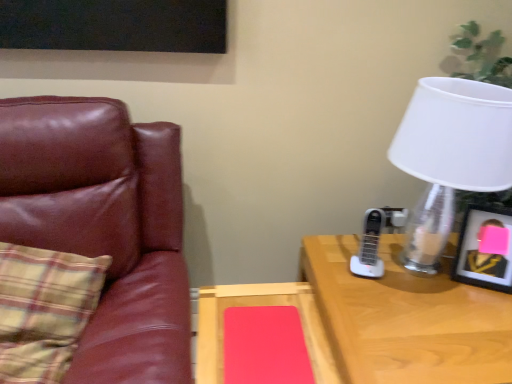
The width and height of the screenshot is (512, 384). Find the location of `vacant area that is in front of white matte lampshade at upper right`. vacant area that is in front of white matte lampshade at upper right is located at coordinates (437, 332).